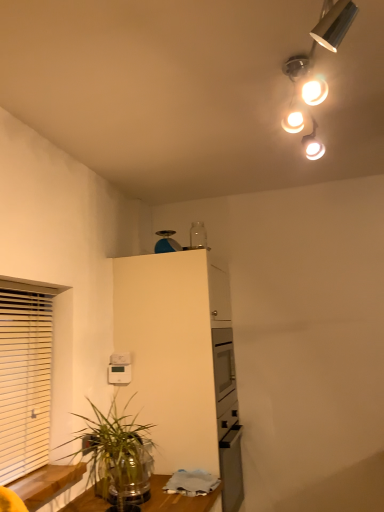
Question: From the image's perspective, is blue plastic scale at upper center positioned above or below green leafy plant at lower left?

Choices:
 (A) above
 (B) below

Answer: (A)

Question: From a real-world perspective, relative to green leafy plant at lower left, is blue plastic scale at upper center vertically above or below?

Choices:
 (A) below
 (B) above

Answer: (B)

Question: Estimate the real-world distances between objects in this image. Which object is farther from the green leafy plant at lower left?

Choices:
 (A) white wooden blinds at left
 (B) matte silver lamp at upper right
 (C) white matte cabinet at upper center
 (D) blue plastic scale at upper center

Answer: (B)

Question: Which object is the farthest from the white matte cabinet at upper center?

Choices:
 (A) matte silver lamp at upper right
 (B) green leafy plant at lower left
 (C) blue plastic scale at upper center
 (D) white wooden blinds at left

Answer: (A)